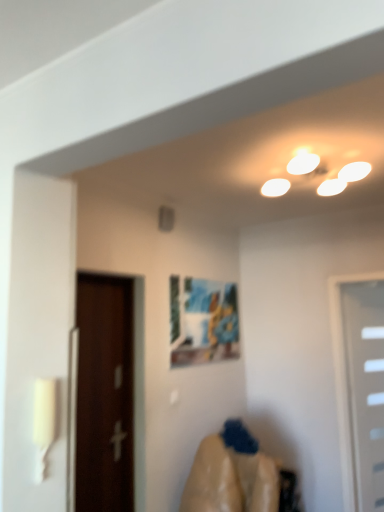
What is the approximate width of matte plastic picture frame at center?

matte plastic picture frame at center is 3.20 centimeters wide.

Identify the location of white plastic door at right, the second door in the left-to-right sequence. The width and height of the screenshot is (384, 512). (366, 387).

You are a GUI agent. You are given a task and a screenshot of the screen. Output one action in this format:
    pyautogui.click(x=<x>, y=<y>)
    Task: Click on the matte plastic picture frame at center
    The height and width of the screenshot is (512, 384).
    Given the screenshot: What is the action you would take?
    pyautogui.click(x=203, y=321)

From the image's perspective, is matte plastic picture frame at center located above smooth beige fabric at lower center?

Correct, matte plastic picture frame at center appears higher than smooth beige fabric at lower center in the image.

Considering the sizes of matte plastic picture frame at center and smooth beige fabric at lower center in the image, is matte plastic picture frame at center taller or shorter than smooth beige fabric at lower center?

Clearly, matte plastic picture frame at center is shorter compared to smooth beige fabric at lower center.

From the picture: Is matte plastic picture frame at center facing towards smooth beige fabric at lower center?

No, matte plastic picture frame at center is not facing towards smooth beige fabric at lower center.

From the image's perspective, which object appears higher, brown wooden door at left, positioned as the first door in front-to-back order, or matte plastic picture frame at center?

matte plastic picture frame at center.

Visually, is brown wooden door at left, the second door from the back, positioned to the left or to the right of matte plastic picture frame at center?

brown wooden door at left, the second door from the back, is positioned on matte plastic picture frame at center's left side.

Does brown wooden door at left, the second door from the back, have a greater height compared to matte plastic picture frame at center?

Yes, brown wooden door at left, the second door from the back, is taller than matte plastic picture frame at center.

From a real-world perspective, is brown wooden door at left, positioned as the first door in front-to-back order, positioned above or below matte plastic picture frame at center?

From a real-world perspective, brown wooden door at left, positioned as the first door in front-to-back order, is physically below matte plastic picture frame at center.

You are a GUI agent. You are given a task and a screenshot of the screen. Output one action in this format:
    pyautogui.click(x=<x>, y=<y>)
    Task: Click on the woman to the right of brown wooden door at left, the second door from the back
    Image resolution: width=384 pixels, height=512 pixels.
    Given the screenshot: What is the action you would take?
    pyautogui.click(x=231, y=474)

From the image's perspective, is brown wooden door at left, positioned as the first door in front-to-back order, positioned above or below smooth beige fabric at lower center?

brown wooden door at left, positioned as the first door in front-to-back order, is above smooth beige fabric at lower center.

Is brown wooden door at left, the second door from the back, oriented towards smooth beige fabric at lower center?

No, brown wooden door at left, the second door from the back, is not oriented towards smooth beige fabric at lower center.

Who is smaller, brown wooden door at left, which is the first door from left to right, or smooth beige fabric at lower center?

brown wooden door at left, which is the first door from left to right, is smaller.

Between white plastic door at right, the second door in the left-to-right sequence, and smooth beige fabric at lower center, which one appears on the left side from the viewer's perspective?

Positioned to the left is smooth beige fabric at lower center.

From a real-world perspective, starting from the smooth beige fabric at lower center, which door is the 1st one vertically above it? Please provide its 2D coordinates.

[(366, 387)]

Consider the image. Is white plastic door at right, the second door in the left-to-right sequence, not close to smooth beige fabric at lower center?

white plastic door at right, the second door in the left-to-right sequence, is positioned a significant distance from smooth beige fabric at lower center.

Which is further, (373, 369) or (235, 488)?

Positioned behind is point (373, 369).

Considering the relative sizes of matte plastic picture frame at center and brown wooden door at left, the 2th door in the right-to-left sequence, in the image provided, is matte plastic picture frame at center shorter than brown wooden door at left, the 2th door in the right-to-left sequence,?

Correct, matte plastic picture frame at center is not as tall as brown wooden door at left, the 2th door in the right-to-left sequence.

Is matte plastic picture frame at center aimed at brown wooden door at left, the second door from the back?

No, matte plastic picture frame at center does not turn towards brown wooden door at left, the second door from the back.

Considering the sizes of objects matte plastic picture frame at center and brown wooden door at left, positioned as the first door in front-to-back order, in the image provided, who is thinner, matte plastic picture frame at center or brown wooden door at left, positioned as the first door in front-to-back order,?

Thinner between the two is matte plastic picture frame at center.

From the image's perspective, relative to brown wooden door at left, the second door from the back, is matte plastic picture frame at center above or below?

Based on their image positions, matte plastic picture frame at center is located above brown wooden door at left, the second door from the back.

Can you tell me how much brown wooden door at left, positioned as the first door in front-to-back order, and white plastic door at right, the 1th door in the back-to-front sequence, differ in facing direction?

88.2 degrees.

In the scene shown: Is brown wooden door at left, the second door from the back, thinner than white plastic door at right, the second door in the left-to-right sequence?

Correct, the width of brown wooden door at left, the second door from the back, is less than that of white plastic door at right, the second door in the left-to-right sequence.

In the scene shown: Which object is further away from the camera taking this photo, brown wooden door at left, the second door from the back, or white plastic door at right, the 1th door in the back-to-front sequence?

Positioned behind is white plastic door at right, the 1th door in the back-to-front sequence.

Would you consider brown wooden door at left, the 2th door in the right-to-left sequence, to be distant from white plastic door at right, the 1th door in the back-to-front sequence?

brown wooden door at left, the 2th door in the right-to-left sequence, is positioned a significant distance from white plastic door at right, the 1th door in the back-to-front sequence.

Is matte plastic picture frame at center inside white plastic door at right, the 1th door in the back-to-front sequence?

Definitely not — matte plastic picture frame at center is not inside white plastic door at right, the 1th door in the back-to-front sequence.

From the picture: Is white plastic door at right, acting as the second door starting from the front, oriented towards matte plastic picture frame at center?

No, white plastic door at right, acting as the second door starting from the front, is not oriented towards matte plastic picture frame at center.

Considering the points (377, 393) and (227, 304), which point is behind, point (377, 393) or point (227, 304)?

Point (227, 304)

From the picture: How different are the orientations of white plastic door at right, the 1th door in the back-to-front sequence, and matte plastic picture frame at center in degrees?

They differ by 89.3 degrees in their facing directions.

Locate an element on the screen. The width and height of the screenshot is (384, 512). picture frame that appears on the left of smooth beige fabric at lower center is located at coordinates (203, 321).

Locate an element on the screen. picture frame located above the brown wooden door at left, the 2th door in the right-to-left sequence (from the image's perspective) is located at coordinates (203, 321).

Based on their spatial positions, is matte plastic picture frame at center or white plastic door at right, the second door in the left-to-right sequence, further from smooth beige fabric at lower center?

Based on the image, white plastic door at right, the second door in the left-to-right sequence, appears to be further to smooth beige fabric at lower center.

Looking at the image, which one is located closer to brown wooden door at left, the 2th door in the right-to-left sequence, matte plastic picture frame at center or white plastic door at right, acting as the second door starting from the front?

Among the two, matte plastic picture frame at center is located nearer to brown wooden door at left, the 2th door in the right-to-left sequence.

Considering their positions, is brown wooden door at left, the 2th door in the right-to-left sequence, positioned closer to matte plastic picture frame at center than smooth beige fabric at lower center?

Based on the image, brown wooden door at left, the 2th door in the right-to-left sequence, appears to be nearer to matte plastic picture frame at center.

Which object lies nearer to the anchor point brown wooden door at left, the second door from the back, smooth beige fabric at lower center or matte plastic picture frame at center?

Based on the image, matte plastic picture frame at center appears to be nearer to brown wooden door at left, the second door from the back.

When comparing their distances from white plastic door at right, which appears as the 1th door when viewed from the right, does smooth beige fabric at lower center or matte plastic picture frame at center seem closer?

smooth beige fabric at lower center is positioned closer to the anchor white plastic door at right, which appears as the 1th door when viewed from the right.

Based on their spatial positions, is white plastic door at right, acting as the second door starting from the front, or brown wooden door at left, positioned as the first door in front-to-back order, closer to matte plastic picture frame at center?

Based on the image, brown wooden door at left, positioned as the first door in front-to-back order, appears to be nearer to matte plastic picture frame at center.

Looking at the image, which one is located closer to smooth beige fabric at lower center, matte plastic picture frame at center or brown wooden door at left, positioned as the first door in front-to-back order?

brown wooden door at left, positioned as the first door in front-to-back order, lies closer to smooth beige fabric at lower center than the other object.

Estimate the real-world distances between objects in this image. Which object is further from white plastic door at right, which appears as the 1th door when viewed from the right, brown wooden door at left, positioned as the first door in front-to-back order, or matte plastic picture frame at center?

brown wooden door at left, positioned as the first door in front-to-back order, lies further to white plastic door at right, which appears as the 1th door when viewed from the right, than the other object.

You are a GUI agent. You are given a task and a screenshot of the screen. Output one action in this format:
    pyautogui.click(x=<x>, y=<y>)
    Task: Click on the woman situated between matte plastic picture frame at center and white plastic door at right, which appears as the 1th door when viewed from the right, from left to right
    This screenshot has height=512, width=384.
    Given the screenshot: What is the action you would take?
    pyautogui.click(x=231, y=474)

Identify the location of woman situated between brown wooden door at left, which is the first door from left to right, and white plastic door at right, which appears as the 1th door when viewed from the right, from left to right. (231, 474).

Locate an element on the screen. picture frame located between brown wooden door at left, the 2th door in the right-to-left sequence, and white plastic door at right, the second door in the left-to-right sequence, in the left-right direction is located at coordinates tap(203, 321).